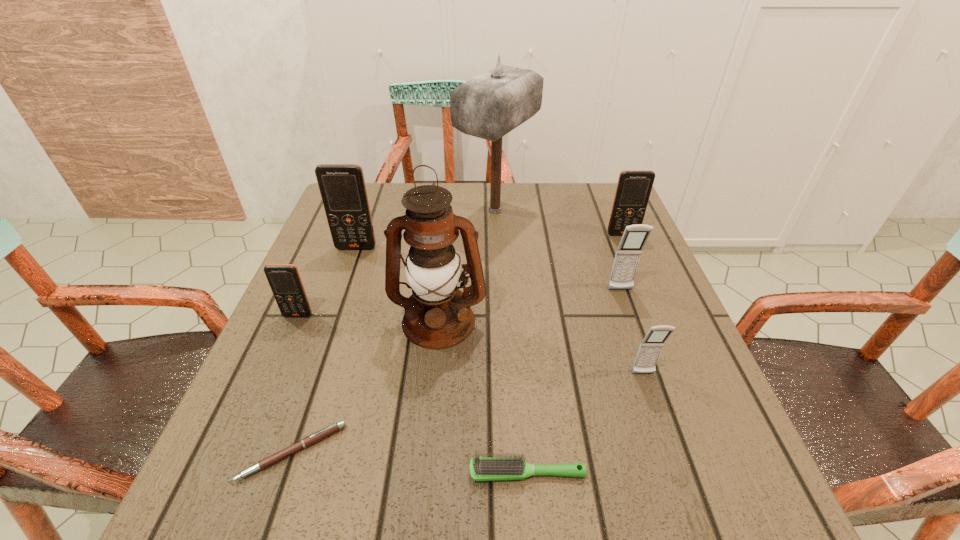
Locate an element on the screen. mallet is located at coordinates (488, 106).

Image resolution: width=960 pixels, height=540 pixels. Identify the location of the second tallest object. (437, 315).

What are the coordinates of `brown lantern` in the screenshot? It's located at (437, 315).

Find the location of a particular element. The width and height of the screenshot is (960, 540). the second farthest orange cellular telephone is located at coordinates (342, 187).

Locate an element on the screen. The width and height of the screenshot is (960, 540). the third tallest object is located at coordinates (342, 187).

Identify the location of the farther gray cellular telephone. This screenshot has height=540, width=960. (627, 257).

Identify the location of the sixth nearest object. The height and width of the screenshot is (540, 960). (627, 257).

You are a GUI agent. You are given a task and a screenshot of the screen. Output one action in this format:
    pyautogui.click(x=<x>, y=<y>)
    Task: Click on the farthest orange cellular telephone
    
    Given the screenshot: What is the action you would take?
    pyautogui.click(x=634, y=187)

Image resolution: width=960 pixels, height=540 pixels. I want to click on the farthest cellular telephone, so click(634, 187).

In order to click on the smallest orange cellular telephone in this screenshot , I will do `click(284, 279)`.